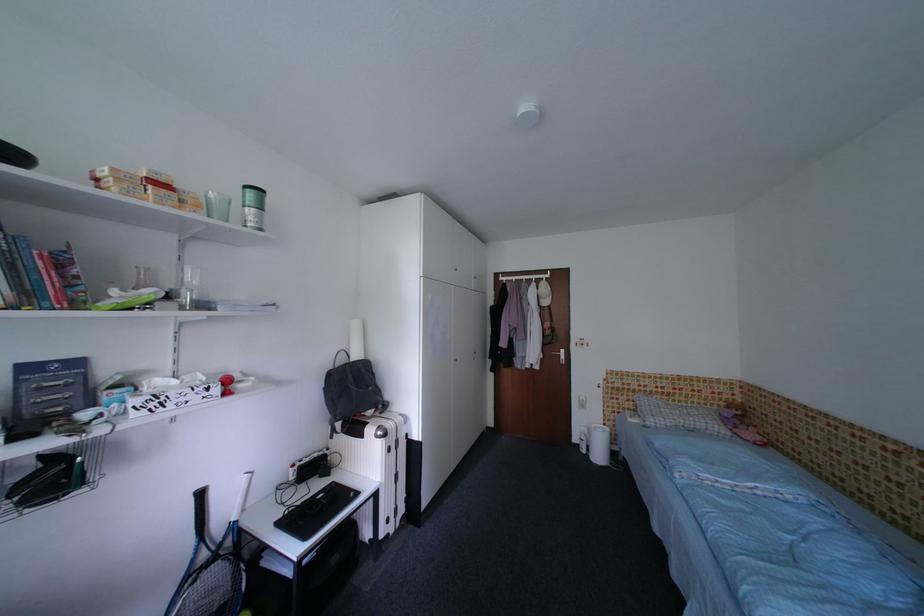
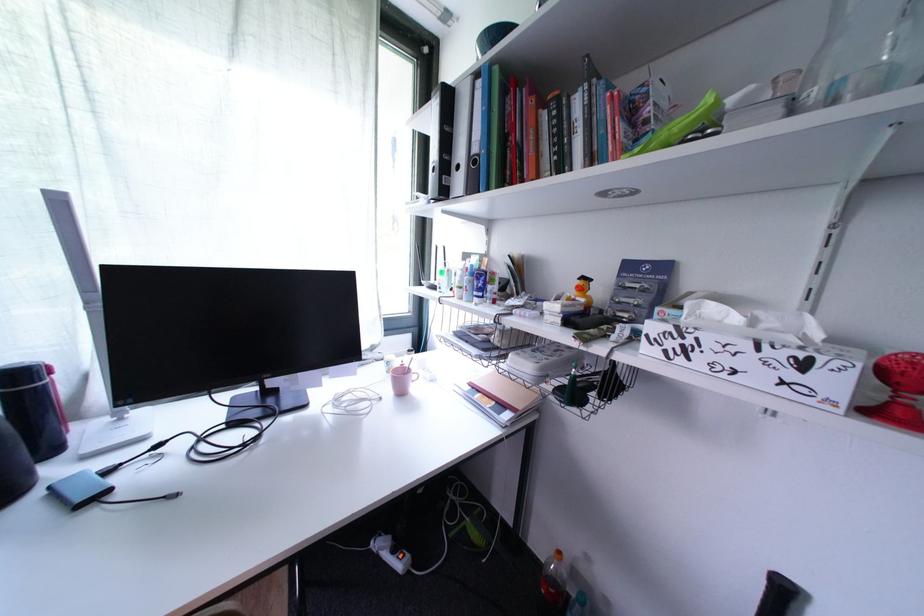
Question: The camera is either moving clockwise (left) or counter-clockwise (right) around the object. The first image is from the beginning of the video and the second image is from the end. Is the camera moving left or right when shooting the video?

Choices:
 (A) Left
 (B) Right

Answer: (B)